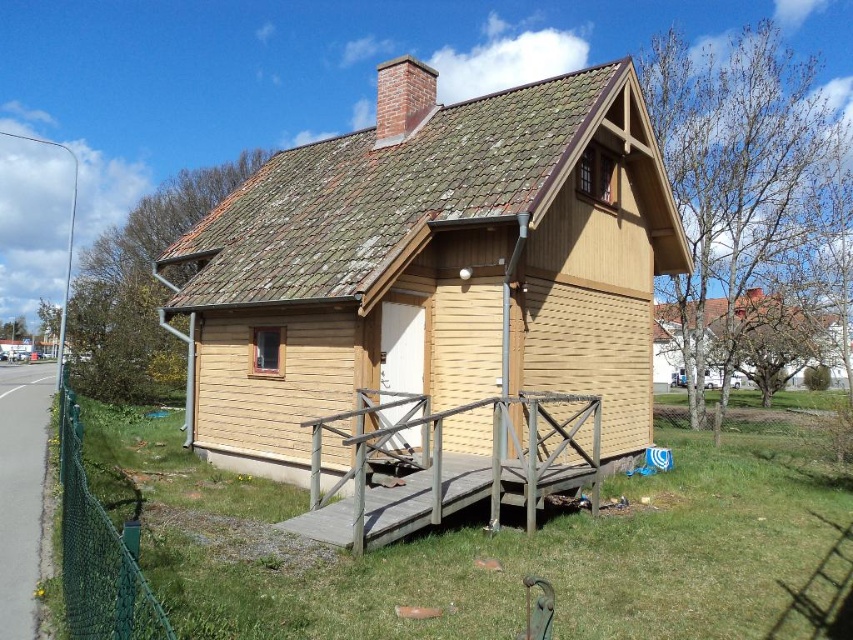
You are standing in front of the wooden cabin at center. If you want to take a photo of the entire cabin without moving your position, what should you do?

Since the wooden cabin at center is 8.96 meters away from the camera, you should use a wide angle lens to capture the entire cabin in the photo.